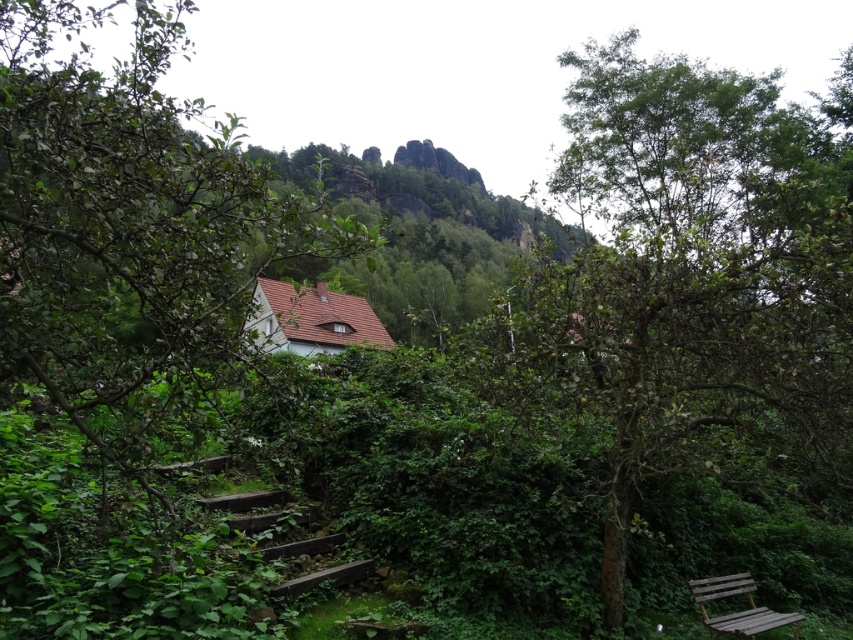
Which of these two, green leafy tree at left or wooden bench at lower right, stands shorter?

Standing shorter between the two is wooden bench at lower right.

Does green leafy tree at left have a larger size compared to wooden bench at lower right?

Yes.

Which is behind, point (0, 324) or point (701, 596)?

The point (701, 596) is behind.

The width and height of the screenshot is (853, 640). Identify the location of green leafy tree at left. (131, 236).

Does point (601, 356) come farther from viewer compared to point (784, 612)?

No, (601, 356) is in front of (784, 612).

Looking at this image, can you confirm if green leafy tree at center is taller than wooden bench at lower right?

Correct, green leafy tree at center is much taller as wooden bench at lower right.

Is point (567, 198) less distant than point (747, 577)?

That is False.

Where is `green leafy tree at center`? The width and height of the screenshot is (853, 640). green leafy tree at center is located at coordinates (693, 285).

Does green leafy tree at center appear over green leafy tree at left?

No.

Is green leafy tree at center positioned at the back of green leafy tree at left?

That is True.

Does point (744, 349) come farther from viewer compared to point (48, 266)?

Yes, it is.

Find the location of a particular element. This screenshot has height=640, width=853. green leafy tree at center is located at coordinates (693, 285).